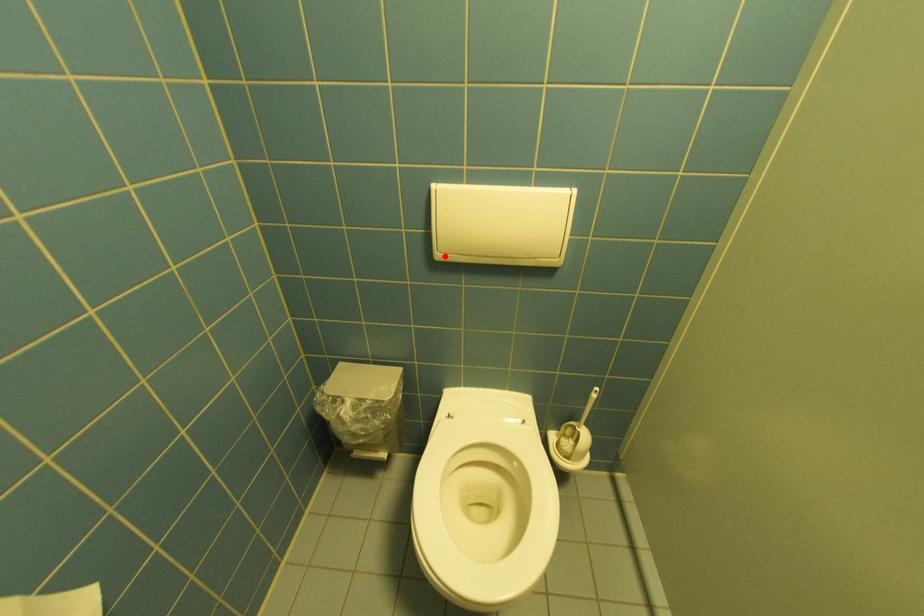
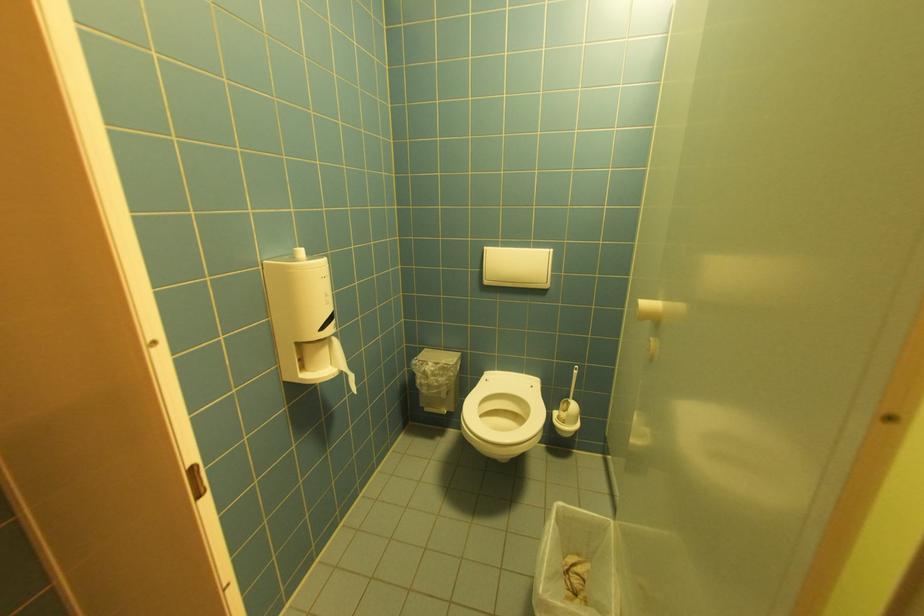
Locate, in the second image, the point that corresponds to the highlighted location in the first image.

(492, 283)